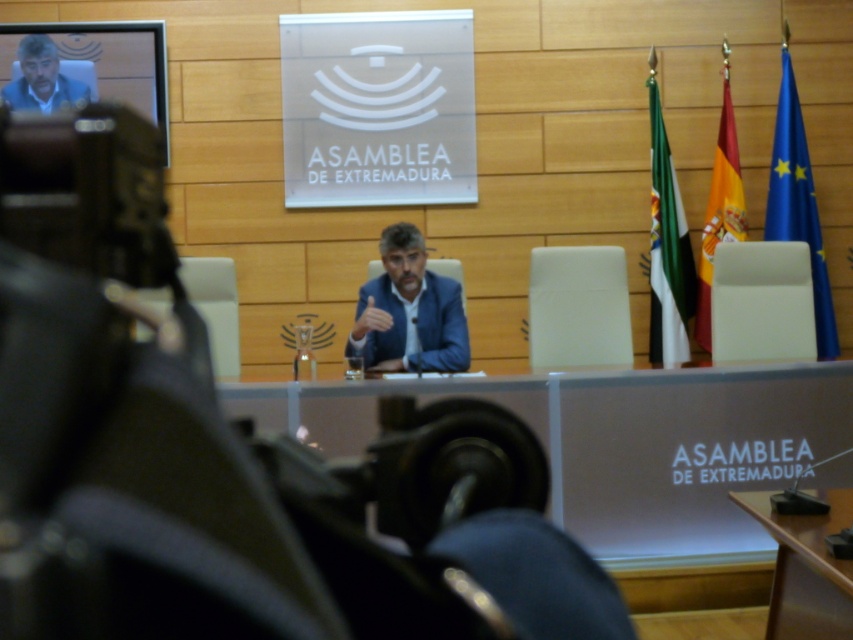
Is wooden table at center positioned at the back of matte blue suit at upper left?

No.

In the scene shown: How far apart are wooden table at center and matte blue suit at upper left?

wooden table at center and matte blue suit at upper left are 15.61 feet apart from each other.

Between point (778, 580) and point (44, 97), which one is positioned in front?

Positioned in front is point (778, 580).

Identify the location of wooden table at center. (805, 568).

Looking at this image, is blue fabric suit at center below matte blue suit at upper left?

Yes.

Can you confirm if blue fabric suit at center is smaller than matte blue suit at upper left?

Incorrect, blue fabric suit at center is not smaller in size than matte blue suit at upper left.

Does point (467, 349) come farther from viewer compared to point (6, 84)?

No, it is not.

Find the location of `blue fabric suit at center`. blue fabric suit at center is located at coordinates (408, 310).

Is point (454, 298) positioned in front of point (836, 524)?

No, it is not.

I want to click on blue fabric suit at center, so click(x=408, y=310).

The height and width of the screenshot is (640, 853). Find the location of `blue fabric suit at center`. blue fabric suit at center is located at coordinates (408, 310).